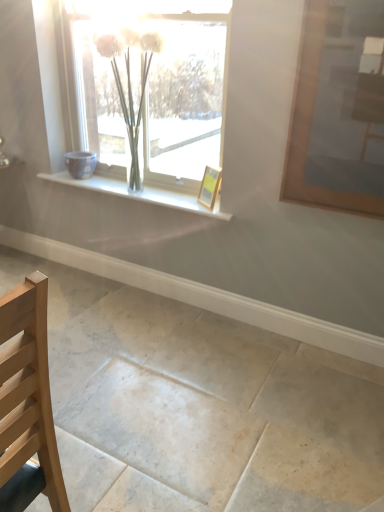
Question: Can you confirm if white glossy window sill at center is positioned to the left of wooden picture frame at center, the second picture frame positioned from the front?

Choices:
 (A) no
 (B) yes

Answer: (B)

Question: Is white glossy window sill at center looking in the opposite direction of wooden picture frame at center, the 1th picture frame positioned from the back?

Choices:
 (A) yes
 (B) no

Answer: (B)

Question: Is white glossy window sill at center far away from wooden picture frame at center, the second picture frame positioned from the front?

Choices:
 (A) yes
 (B) no

Answer: (B)

Question: Does white glossy window sill at center have a smaller size compared to wooden picture frame at center, the 1th picture frame positioned from the back?

Choices:
 (A) no
 (B) yes

Answer: (A)

Question: From a real-world perspective, is white glossy window sill at center physically below wooden picture frame at center, which ranks as the second picture frame in right-to-left order?

Choices:
 (A) yes
 (B) no

Answer: (A)

Question: Does white glossy window sill at center lie in front of wooden picture frame at center, which ranks as the first picture frame in left-to-right order?

Choices:
 (A) no
 (B) yes

Answer: (A)

Question: Could you tell me if smooth stone floor at center is turned towards white glossy window sill at center?

Choices:
 (A) no
 (B) yes

Answer: (A)

Question: Can you confirm if smooth stone floor at center is smaller than white glossy window sill at center?

Choices:
 (A) no
 (B) yes

Answer: (A)

Question: From the image's perspective, is smooth stone floor at center below white glossy window sill at center?

Choices:
 (A) no
 (B) yes

Answer: (B)

Question: From a real-world perspective, does smooth stone floor at center stand above white glossy window sill at center?

Choices:
 (A) no
 (B) yes

Answer: (A)

Question: Is smooth stone floor at center at the right side of white glossy window sill at center?

Choices:
 (A) no
 (B) yes

Answer: (A)

Question: Can you confirm if smooth stone floor at center is bigger than white glossy window sill at center?

Choices:
 (A) yes
 (B) no

Answer: (A)

Question: Is light wood chair at lower left located outside clear glass vase at upper center?

Choices:
 (A) no
 (B) yes

Answer: (B)